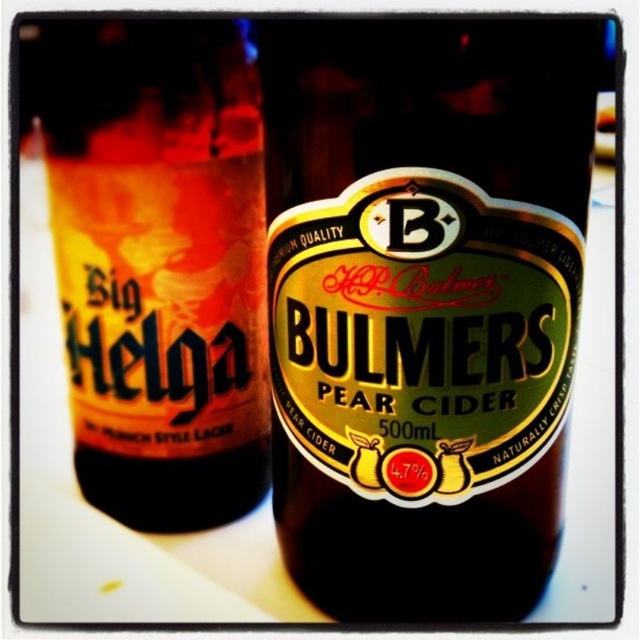
You are organizing a drinks station and need to place the green glass bottle at center and the matte glass bottle at left. If the shelf has limited space, which bottle should you place first to ensure both fit?

The matte glass bottle at left is smaller, so place it first to accommodate the larger green glass bottle at center afterward.

You are taking a photo of two bottles. There are two points marked on the bottles, one at point (365, 60) and another at point (182, 65). Which point is closer to the camera?

Point (365, 60) is closer to the camera than point (182, 65).

You are at a party and need to grab a drink quickly. There are two bottles in front of you, a green glass bottle at center and a matte glass bottle at left. Which one is closer to you?

The green glass bottle at center is closer to you because it is in front of the matte glass bottle at left.